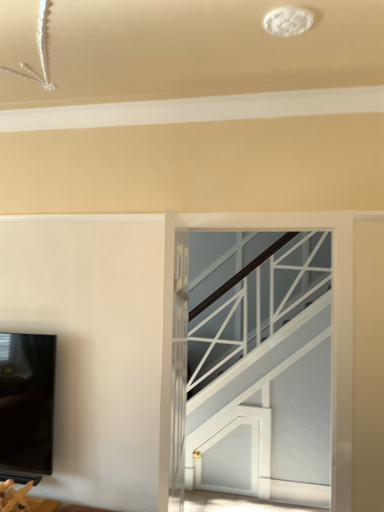
The image size is (384, 512). Identify the location of clear glass door at center. pos(267,382).

What is the approximate width of clear glass door at center?

clear glass door at center is 6.20 inches wide.

This screenshot has height=512, width=384. What do you see at coordinates (267, 382) in the screenshot? I see `clear glass door at center` at bounding box center [267, 382].

Describe the element at coordinates (23, 499) in the screenshot. I see `matte gold figurine at lower left` at that location.

The image size is (384, 512). Find the location of `matte gold figurine at lower left`. matte gold figurine at lower left is located at coordinates (23, 499).

This screenshot has height=512, width=384. I want to click on clear glass door at center, so click(x=267, y=382).

Considering the positions of objects matte gold figurine at lower left and clear glass door at center in the image provided, who is more to the right, matte gold figurine at lower left or clear glass door at center?

From the viewer's perspective, clear glass door at center appears more on the right side.

Which is behind, matte gold figurine at lower left or clear glass door at center?

Positioned behind is clear glass door at center.

Between point (25, 496) and point (256, 272), which one is positioned in front?

The point (25, 496) is closer.

From the image's perspective, is matte gold figurine at lower left above or below clear glass door at center?

Clearly, from the image's perspective, matte gold figurine at lower left is below clear glass door at center.

From a real-world perspective, is matte gold figurine at lower left positioned above or below clear glass door at center?

From a real-world perspective, matte gold figurine at lower left is physically below clear glass door at center.

Which of these two, matte gold figurine at lower left or clear glass door at center, is thinner?

clear glass door at center.

Considering the relative sizes of matte gold figurine at lower left and clear glass door at center in the image provided, is matte gold figurine at lower left taller than clear glass door at center?

No, matte gold figurine at lower left is not taller than clear glass door at center.

Is matte gold figurine at lower left bigger than clear glass door at center?

Incorrect, matte gold figurine at lower left is not larger than clear glass door at center.

Which is correct: matte gold figurine at lower left is inside clear glass door at center, or outside of it?

matte gold figurine at lower left lies outside clear glass door at center.

Is matte gold figurine at lower left far from clear glass door at center?

Yes, matte gold figurine at lower left is far from clear glass door at center.

Does matte gold figurine at lower left turn towards clear glass door at center?

No, matte gold figurine at lower left is not aimed at clear glass door at center.

What's the angular difference between matte gold figurine at lower left and clear glass door at center's facing directions?

1.81 degrees.

Looking at this image, measure the distance between matte gold figurine at lower left and clear glass door at center.

The distance of matte gold figurine at lower left from clear glass door at center is 5.85 feet.

What are the coordinates of `glass door behind the matte gold figurine at lower left` in the screenshot? It's located at (267, 382).

Is clear glass door at center at the right side of matte gold figurine at lower left?

Correct, you'll find clear glass door at center to the right of matte gold figurine at lower left.

Which is in front, clear glass door at center or matte gold figurine at lower left?

matte gold figurine at lower left is more forward.

Does point (287, 410) appear closer or farther from the camera than point (9, 485)?

Point (287, 410) appears to be farther away from the viewer than point (9, 485).

From the image's perspective, relative to matte gold figurine at lower left, is clear glass door at center above or below?

Based on their image positions, clear glass door at center is located above matte gold figurine at lower left.

From a real-world perspective, is clear glass door at center on matte gold figurine at lower left?

Indeed, from a real-world perspective, clear glass door at center stands above matte gold figurine at lower left.

Which of these two, clear glass door at center or matte gold figurine at lower left, is wider?

Wider between the two is matte gold figurine at lower left.

In the scene shown: Considering the sizes of objects clear glass door at center and matte gold figurine at lower left in the image provided, who is taller, clear glass door at center or matte gold figurine at lower left?

clear glass door at center.

Is clear glass door at center bigger than matte gold figurine at lower left?

Indeed, clear glass door at center has a larger size compared to matte gold figurine at lower left.

Is clear glass door at center spatially inside matte gold figurine at lower left, or outside of it?

clear glass door at center lies outside matte gold figurine at lower left.

Are clear glass door at center and matte gold figurine at lower left far apart?

clear glass door at center is positioned a significant distance from matte gold figurine at lower left.

Does clear glass door at center turn towards matte gold figurine at lower left?

No.

From the picture: How different are the orientations of clear glass door at center and matte gold figurine at lower left in degrees?

clear glass door at center and matte gold figurine at lower left are facing 1.81 degrees away from each other.

At what (x,y) coordinates should I click in order to perform the action: click on glass door above the matte gold figurine at lower left (from a real-world perspective). Please return your answer as a coordinate pair (x, y). The image size is (384, 512). Looking at the image, I should click on (267, 382).

Find the location of a particular element. The width and height of the screenshot is (384, 512). furniture in front of the clear glass door at center is located at coordinates (23, 499).

Identify the location of glass door above the matte gold figurine at lower left (from a real-world perspective). (267, 382).